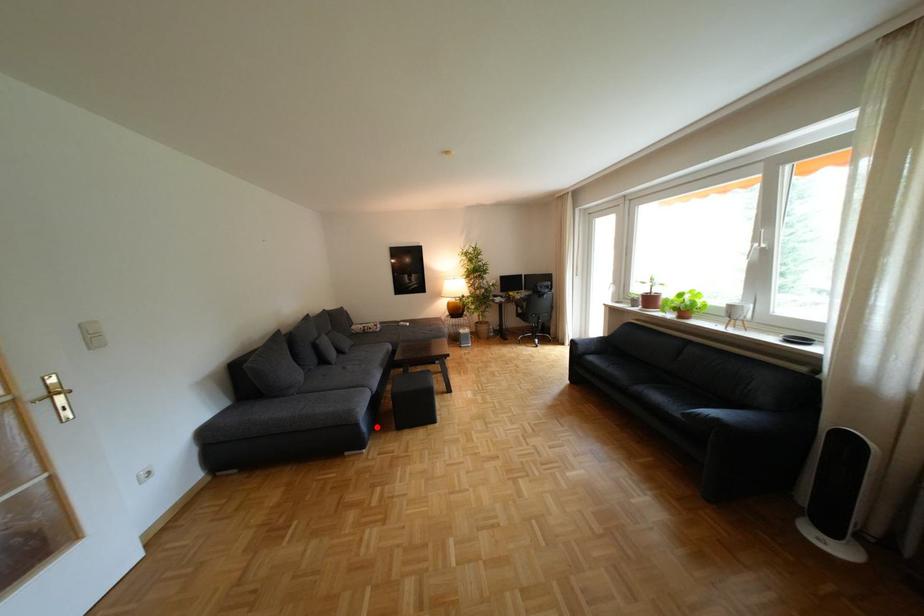
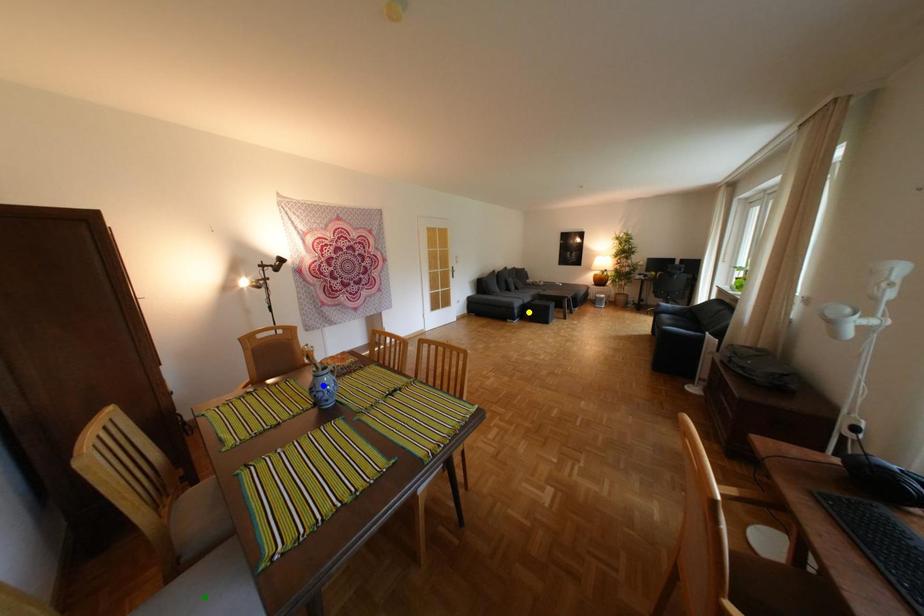
Question: I am providing you with two images of the same scene from different viewpoints. A red point is marked on the first image. You are given multiple points on the second image. Which mark in image 2 goes with the point in image 1?

Choices:
 (A) green point
 (B) yellow point
 (C) blue point

Answer: (B)